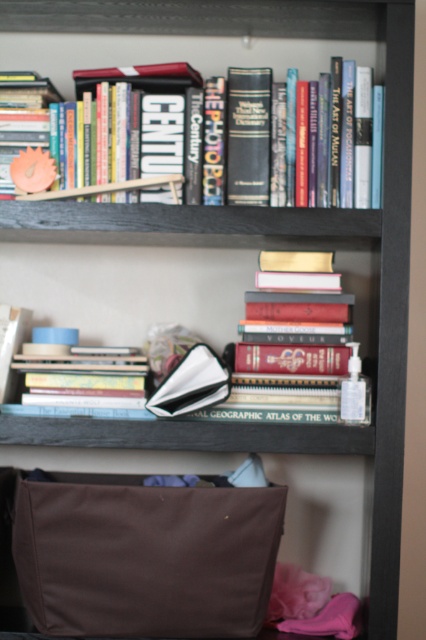
Question: Does hardcover books at center have a lesser width compared to hardcover book at upper center?

Choices:
 (A) yes
 (B) no

Answer: (A)

Question: Which point is closer to the camera?

Choices:
 (A) (227, 145)
 (B) (213, 289)

Answer: (A)

Question: Does hardcover books at center have a greater width compared to hardcover book at upper center?

Choices:
 (A) yes
 (B) no

Answer: (B)

Question: Is hardcover books at center to the left of hardcover book at upper center from the viewer's perspective?

Choices:
 (A) no
 (B) yes

Answer: (B)

Question: Which object is closer to the camera taking this photo?

Choices:
 (A) hardcover book at upper center
 (B) hardcover books at center

Answer: (A)